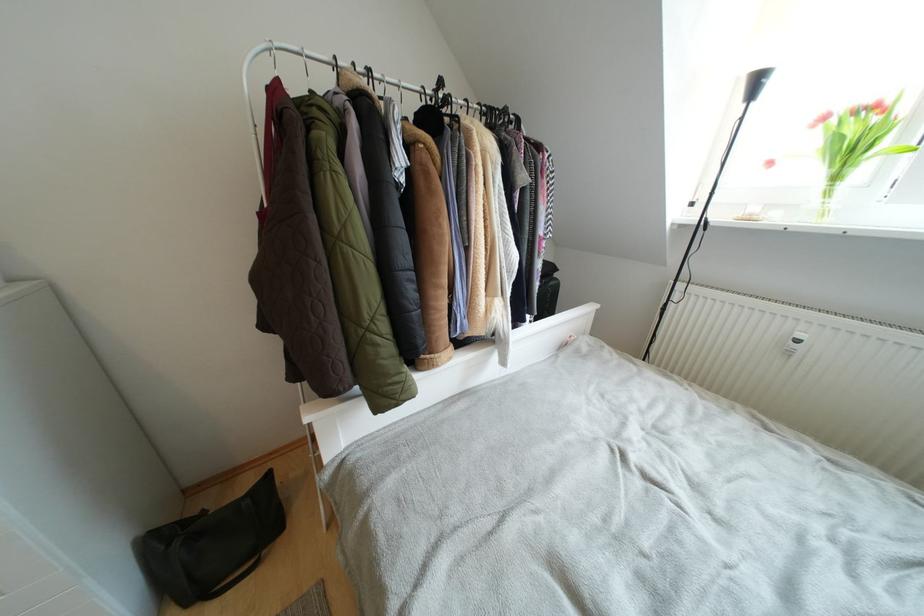
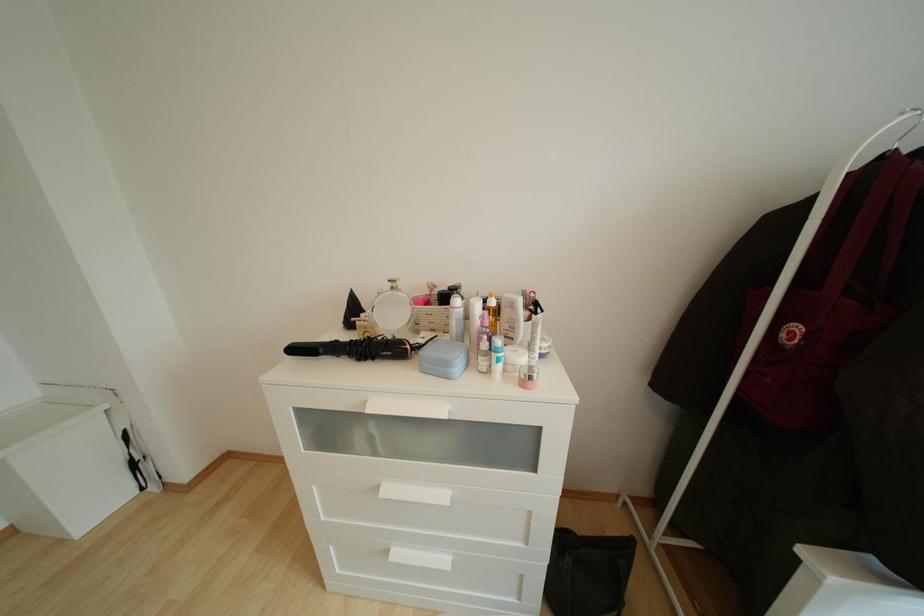
Question: The images are taken continuously from a first-person perspective. In which direction is your viewpoint rotating?

Choices:
 (A) Left
 (B) Right
 (C) Up
 (D) Down

Answer: (A)